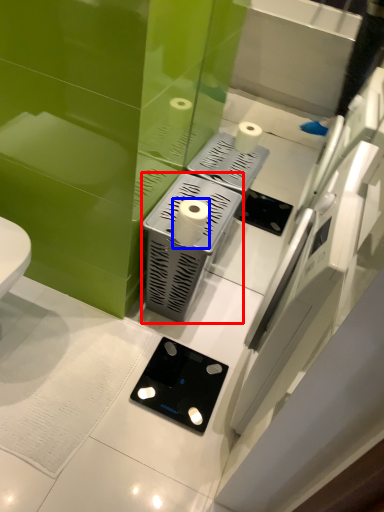
Question: Which of the following is the farthest to the observer, appliance (highlighted by a red box) or toilet paper (highlighted by a blue box)?

Choices:
 (A) appliance
 (B) toilet paper

Answer: (A)